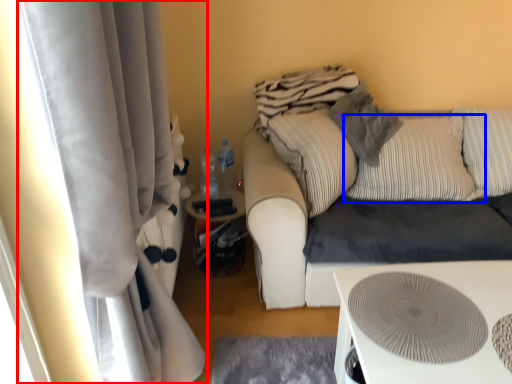
Question: Which point is further to the camera, curtain (highlighted by a red box) or pillow (highlighted by a blue box)?

Choices:
 (A) curtain
 (B) pillow

Answer: (B)